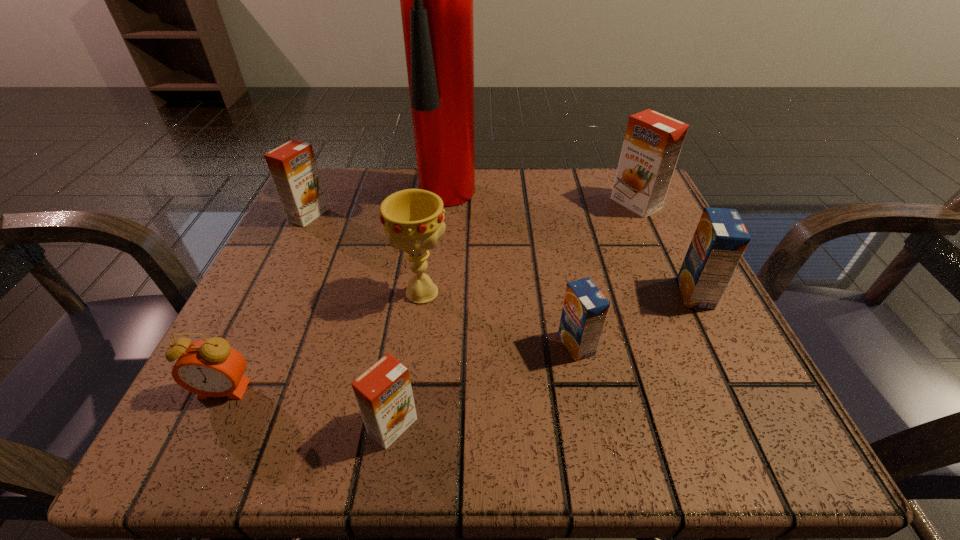
Image resolution: width=960 pixels, height=540 pixels. In order to click on vacant space at the far edge in this screenshot , I will do `click(479, 197)`.

Image resolution: width=960 pixels, height=540 pixels. Identify the location of free space at the near edge of the desktop. (359, 441).

In the image, there is a desktop. Where is `vacant space at the left edge`? vacant space at the left edge is located at coordinates (285, 344).

Where is `vacant space at the right edge of the desktop`? vacant space at the right edge of the desktop is located at coordinates (694, 357).

Locate an element on the screen. vacant space at the far left corner of the desktop is located at coordinates (352, 206).

Locate an element on the screen. vacant space at the far right corner of the desktop is located at coordinates (597, 170).

Where is `vacant region at the near right corner of the desktop`? The height and width of the screenshot is (540, 960). vacant region at the near right corner of the desktop is located at coordinates point(717,449).

Identify the location of unoccupied position between the tallest object and the chalice. The image size is (960, 540). (444, 245).

In order to click on vacant space that's between the chalice and the pink alarm clock in this screenshot , I will do `click(323, 341)`.

Where is `free spot between the second biggest orange orange juice and the third nearest orange juice`? This screenshot has width=960, height=540. free spot between the second biggest orange orange juice and the third nearest orange juice is located at coordinates (502, 254).